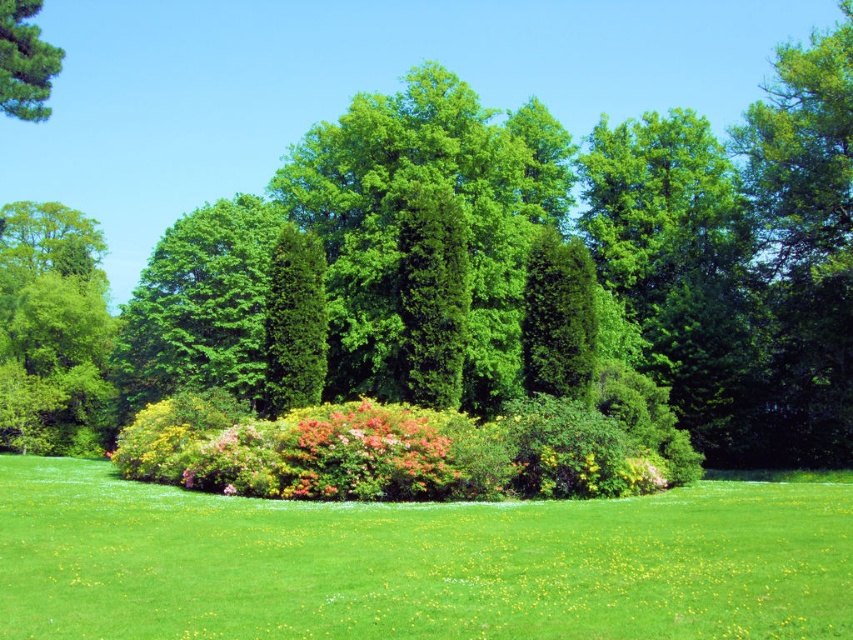
Between vivid pink petals at center and green matte tree at upper left, which one has less height?

vivid pink petals at center is shorter.

Who is lower down, vivid pink petals at center or green matte tree at upper left?

vivid pink petals at center is lower down.

Find the location of a particular element. vivid pink petals at center is located at coordinates (366, 456).